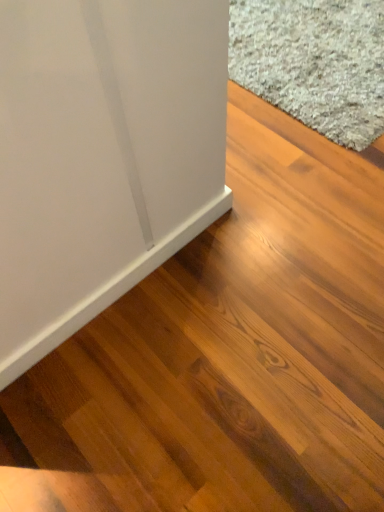
Locate an element on the screen. The width and height of the screenshot is (384, 512). free spot below white matte baseboard at lower left (from a real-world perspective) is located at coordinates (122, 291).